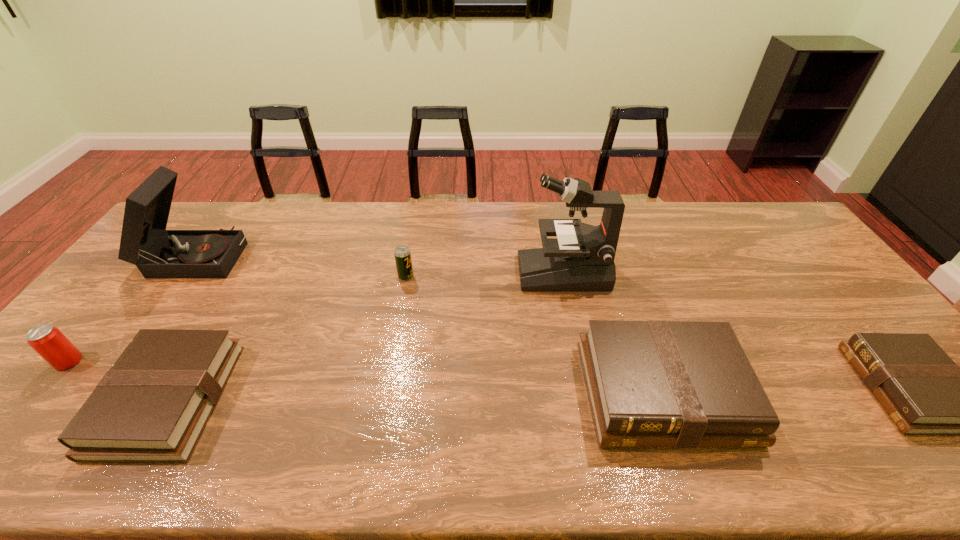
Select which object is the fourth closest to the second Bible from left to right. Please provide its 2D coordinates. Your answer should be formatted as a tuple, i.e. [(x, y)], where the tuple contains the x and y coordinates of a point satisfying the conditions above.

[(152, 406)]

The height and width of the screenshot is (540, 960). What are the coordinates of `the third closest object relative to the phonograph_record` in the screenshot? It's located at tap(402, 254).

Where is `the second closest Bible to the second Bible from right to left`? the second closest Bible to the second Bible from right to left is located at coordinates (152, 406).

Locate an element on the screen. The image size is (960, 540). Bible that is the nearest to the leftmost Bible is located at coordinates (654, 383).

Locate an element on the screen. The image size is (960, 540). vacant point that satisfies the following two spatial constraints: 1. on the front-facing side of the sixth shortest object; 2. on the left side of the fourth object from left to right is located at coordinates (180, 276).